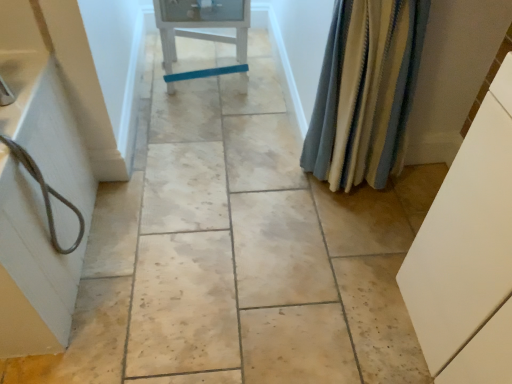
Locate an element on the screen. The width and height of the screenshot is (512, 384). free spot to the left of striped fabric shower curtain at right is located at coordinates (264, 190).